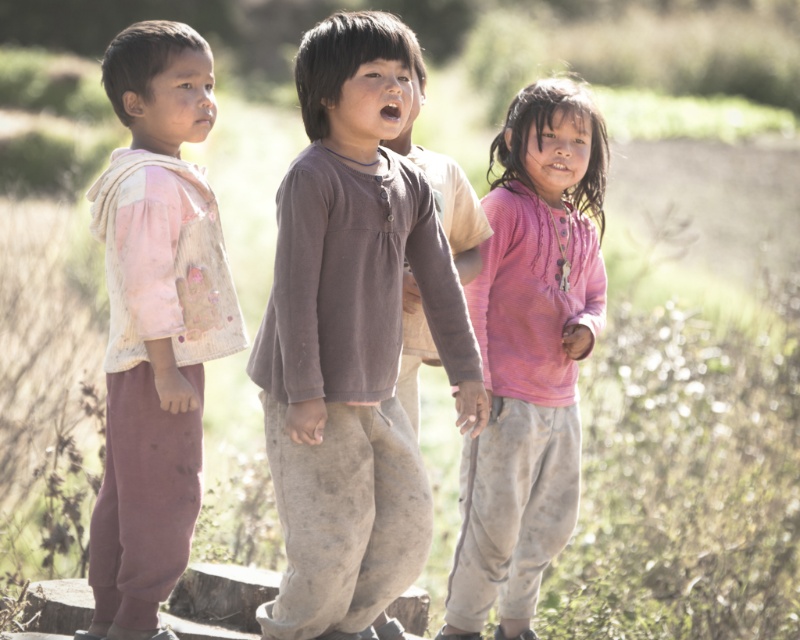
Question: Which point is farther to the camera?

Choices:
 (A) brown cotton shirt at center
 (B) pink ribbed sweater at center
 (C) pink fabric vest at left

Answer: (B)

Question: Can you confirm if brown cotton shirt at center is bigger than pink fabric vest at left?

Choices:
 (A) no
 (B) yes

Answer: (B)

Question: Which point is farther from the camera taking this photo?

Choices:
 (A) (572, 509)
 (B) (108, 417)

Answer: (A)

Question: Which object is the farthest from the pink ribbed sweater at center?

Choices:
 (A) pink fabric vest at left
 (B) brown cotton shirt at center

Answer: (A)

Question: Can you confirm if pink fabric vest at left is bigger than pink ribbed sweater at center?

Choices:
 (A) no
 (B) yes

Answer: (A)

Question: Is brown cotton shirt at center bigger than pink fabric vest at left?

Choices:
 (A) yes
 (B) no

Answer: (A)